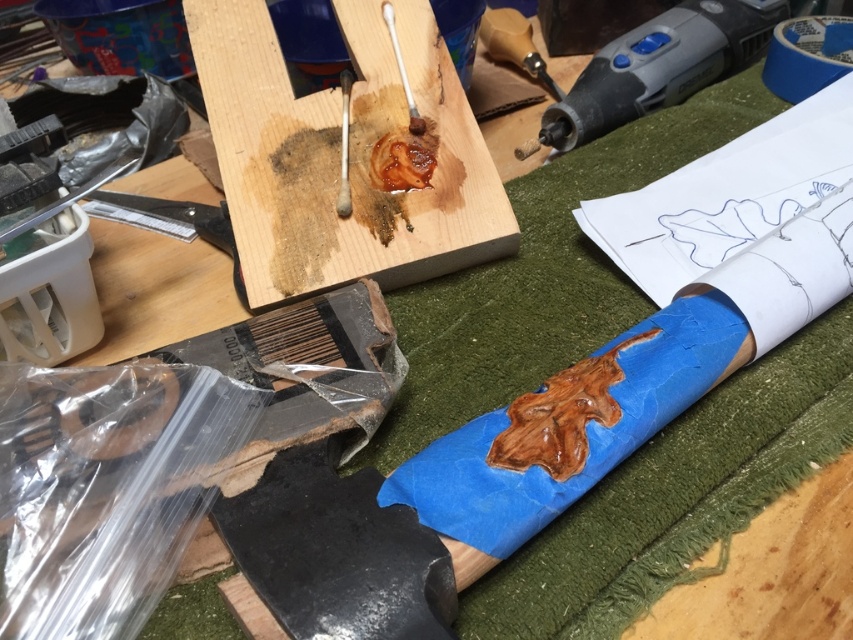
You are a carpenter working on this project and need to place both the matte gray power tool at upper right and the wooden stick at upper center onto a shelf that can only hold items of equal height. Can you determine which one you need to adjust to make them fit?

The matte gray power tool at upper right is taller than the wooden stick at upper center, so you need to lower the height of the matte gray power tool at upper right to match the wooden stick at upper center for them to fit on the shelf.

You are organizing the workspace and need to place both the wooden plank at center and the wooden stick at upper center into a storage bin. Which object should you pick up first to avoid blocking the other?

You should pick up the wooden stick at upper center first because the wooden plank at center is closer to the viewer, so lifting the stick first would prevent it from being blocked by the plank.

You are a carpenter standing at the edge of the workspace. You need to reach the wooden plank at center to apply a finishing touch. Considering your arm can extend 2.5 feet, can you reach it without moving?

The wooden plank at center is 3.58 feet from the camera. Since your arm can only extend 2.5 feet, you cannot reach it without moving closer.